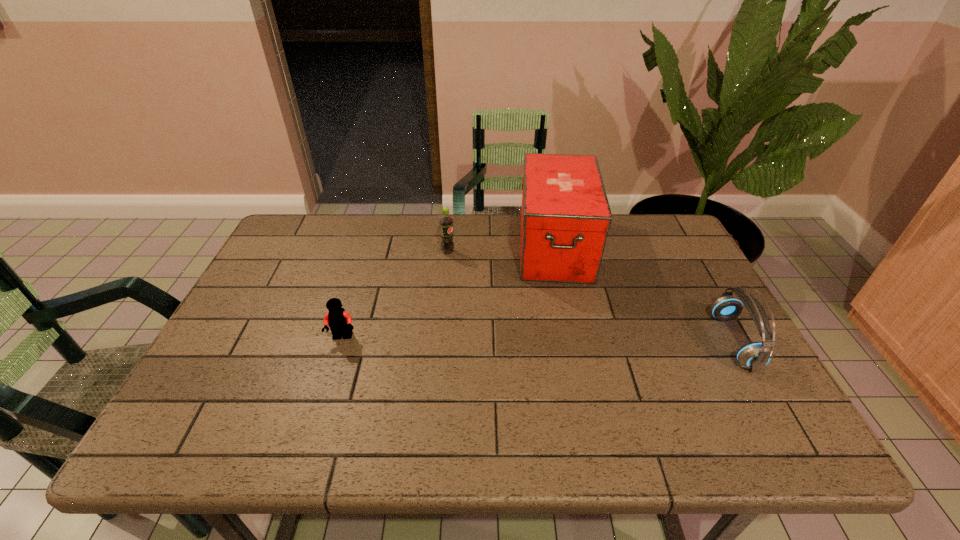
This screenshot has height=540, width=960. I want to click on object located at the near right corner, so click(755, 355).

This screenshot has width=960, height=540. In order to click on vacant space at the far edge of the desktop in this screenshot , I will do [350, 222].

In the image, there is a desktop. In order to click on vacant space at the near edge in this screenshot , I will do `click(652, 385)`.

Image resolution: width=960 pixels, height=540 pixels. I want to click on vacant region at the left edge of the desktop, so click(220, 335).

Find the location of a particular element. The height and width of the screenshot is (540, 960). free space at the right edge of the desktop is located at coordinates (675, 315).

Where is `vacant area at the far left corner`? vacant area at the far left corner is located at coordinates (312, 214).

This screenshot has height=540, width=960. I want to click on vacant space at the far right corner of the desktop, so click(671, 255).

What are the coordinates of `vacant area at the near right corner` in the screenshot? It's located at (701, 376).

Where is `free space between the headset and the shortest object`? The image size is (960, 540). free space between the headset and the shortest object is located at coordinates (539, 339).

Find the location of `blank region between the soda and the shortest object`. blank region between the soda and the shortest object is located at coordinates (396, 295).